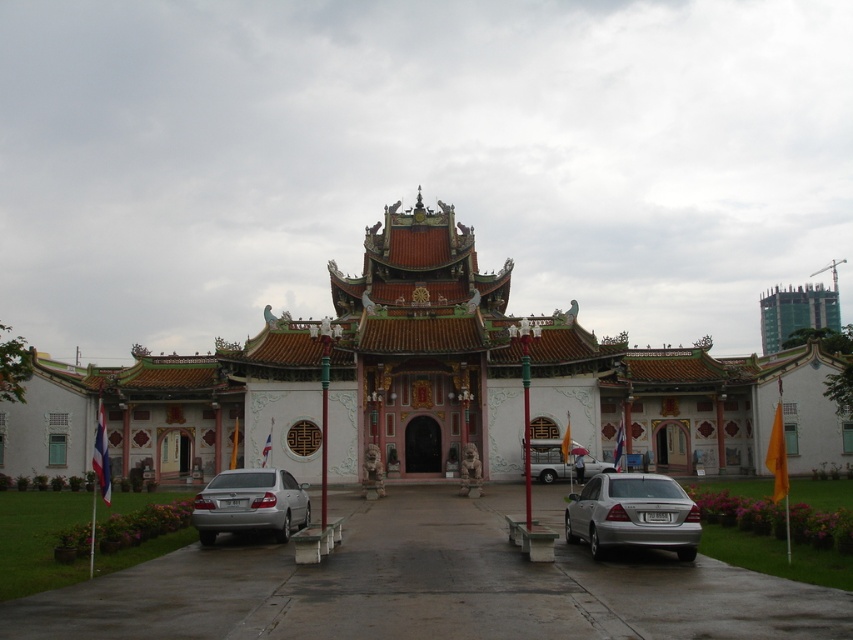
Can you confirm if white glossy palace at center is shorter than silver metallic car at center?

No, white glossy palace at center is not shorter than silver metallic car at center.

Does white glossy palace at center have a greater height compared to silver metallic car at center?

Yes, white glossy palace at center is taller than silver metallic car at center.

Which is behind, point (596, 403) or point (593, 461)?

Point (596, 403)

Locate an element on the screen. The height and width of the screenshot is (640, 853). white glossy palace at center is located at coordinates (422, 353).

Is white glossy palace at center wider than green grass at center?

Yes.

This screenshot has width=853, height=640. What are the coordinates of `white glossy palace at center` in the screenshot? It's located at (422, 353).

Between white glossy palace at center and silver metallic sedan at lower left, which one has more height?

With more height is white glossy palace at center.

Which is above, white glossy palace at center or silver metallic sedan at lower left?

Positioned higher is white glossy palace at center.

The image size is (853, 640). I want to click on white glossy palace at center, so click(422, 353).

This screenshot has width=853, height=640. What are the coordinates of `white glossy palace at center` in the screenshot? It's located at (422, 353).